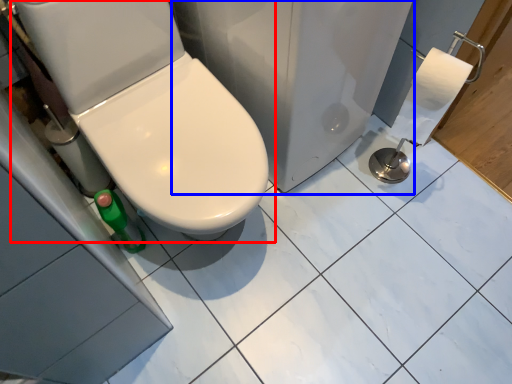
Question: Which point is further to the camera, toilet (highlighted by a red box) or porcelain (highlighted by a blue box)?

Choices:
 (A) toilet
 (B) porcelain

Answer: (B)